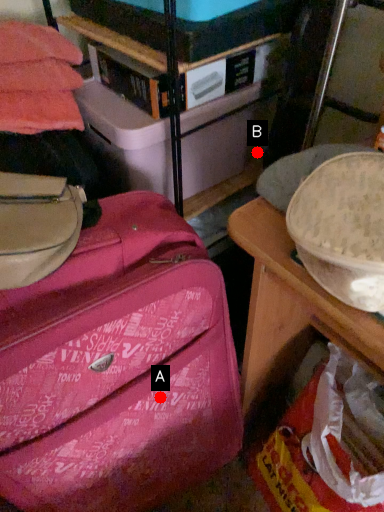
Question: Two points are circled on the image, labeled by A and B beside each circle. Which point is closer to the camera?

Choices:
 (A) A is closer
 (B) B is closer

Answer: (A)